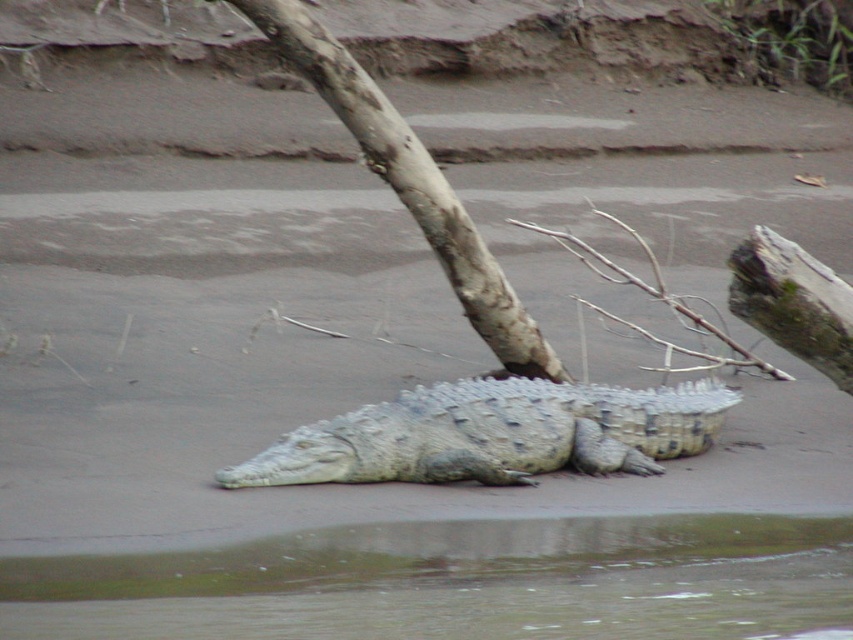
You are a wildlife photographer standing at the camera position. You want to capture a closeup shot of the smooth gray bark at center without getting too close to the crocodile. Can you estimate how far you need to move forward to focus on the bark?

The smooth gray bark at center is 27.45 feet away from the camera, so you need to move forward 27.45 feet to focus on it for a closeup shot.

You are a hiker who wants to place a 3.5 feet long hiking stick between the smooth gray bark at center and the brown rough branch at center right. Can you fit the stick between them without bending it?

The smooth gray bark at center and the brown rough branch at center right are 3.71 feet apart. Since the stick is 3.5 feet long, it can fit between them without bending.